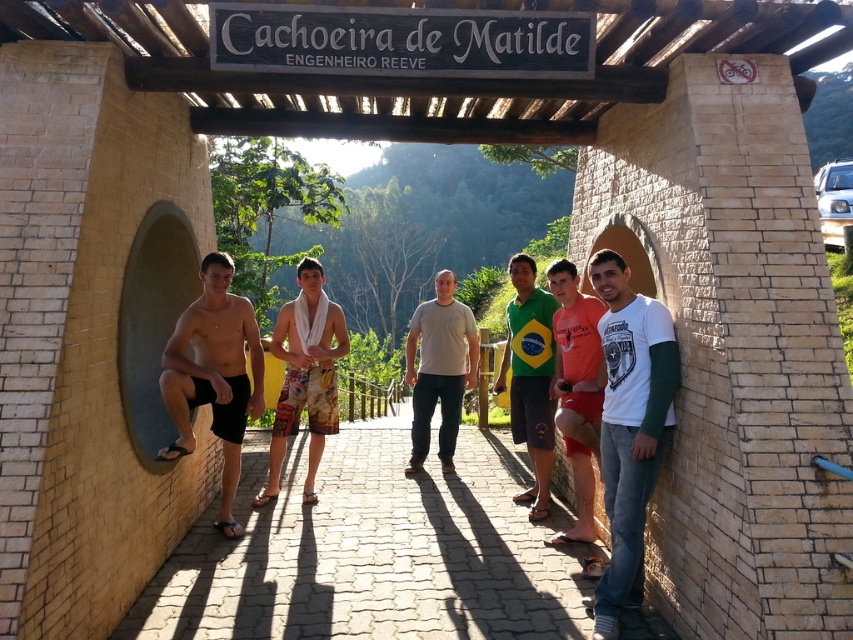
You are standing in front of the wooden and brick archway labeled Cachoeira de Matilde. There is a point marked at coordinates (152, 321). Where is this point located in relation to the gray concrete wall at left?

The point (152, 321) is located on the gray concrete wall at left.

You are a tour guide leading a group through a scenic trail. You notice the paved stone path at center and the dark gray wood sign at center. Which object is wider?

The paved stone path at center is wider than the dark gray wood sign at center.